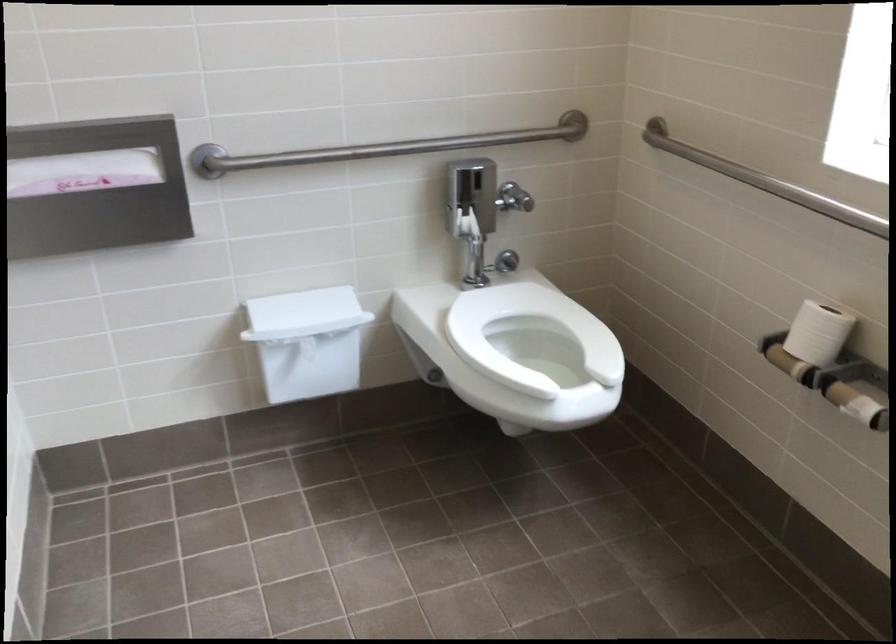
Image resolution: width=896 pixels, height=644 pixels. What are the coordinates of `toilet flush handle` in the screenshot? It's located at (513, 198).